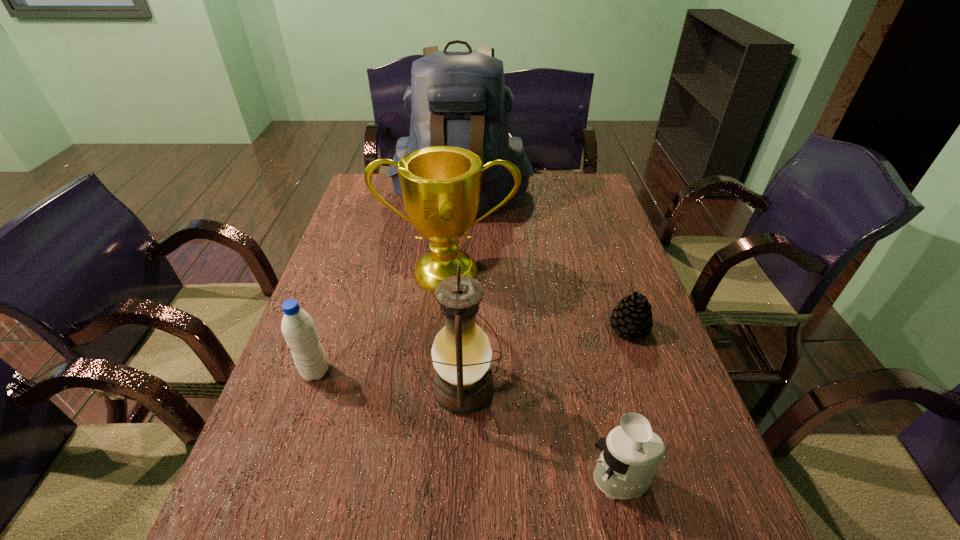
This screenshot has width=960, height=540. In order to click on juicer situated at the right edge in this screenshot , I will do `click(631, 454)`.

You are a GUI agent. You are given a task and a screenshot of the screen. Output one action in this format:
    pyautogui.click(x=<x>, y=<y>)
    Task: Click on the pinecone present at the right edge
    
    Given the screenshot: What is the action you would take?
    pyautogui.click(x=632, y=317)

Identify the location of object present at the far left corner. (459, 99).

Find the location of a particular element. free space at the far edge is located at coordinates pos(515,202).

Find the location of a particular element. This screenshot has width=960, height=540. vacant space at the left edge of the desktop is located at coordinates (317, 298).

The image size is (960, 540). In the image, there is a desktop. Identify the location of vacant area at the right edge. (732, 528).

You are a GUI agent. You are given a task and a screenshot of the screen. Output one action in this format:
    pyautogui.click(x=<x>, y=<y>)
    Task: Click on the blank space at the far right corner
    This screenshot has height=540, width=960.
    Given the screenshot: What is the action you would take?
    pyautogui.click(x=587, y=184)

Locate an element on the screen. The width and height of the screenshot is (960, 540). free point between the nearest object and the fifth nearest object is located at coordinates (535, 376).

Where is `vacant area that lies between the water bottle and the oil lamp`? This screenshot has height=540, width=960. vacant area that lies between the water bottle and the oil lamp is located at coordinates (390, 380).

This screenshot has height=540, width=960. In order to click on free space between the pinecone and the tallest object in this screenshot , I will do `click(545, 262)`.